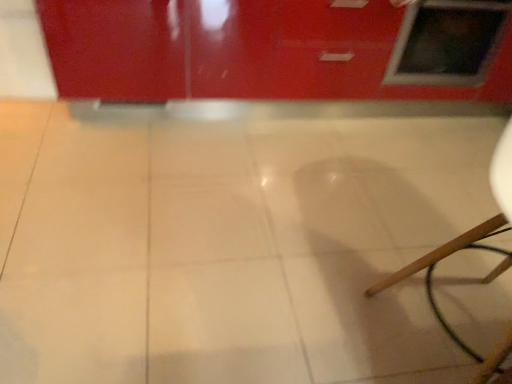
Find the location of a particular element. The image size is (512, 384). white glossy tile at center is located at coordinates (229, 245).

In order to face white glossy tile at center, should I rotate leftwards or rightwards?

Answer: You should look right and rotate roughly 6.554 degrees.

Describe the element at coordinates (229, 245) in the screenshot. I see `white glossy tile at center` at that location.

Image resolution: width=512 pixels, height=384 pixels. What do you see at coordinates (447, 41) in the screenshot?
I see `matte glass window at upper right` at bounding box center [447, 41].

What are the coordinates of `matte glass window at upper right` in the screenshot? It's located at (447, 41).

Where is `white glossy tile at center`? white glossy tile at center is located at coordinates (229, 245).

Which object is positioned more to the right, matte glass window at upper right or white glossy tile at center?

Positioned to the right is matte glass window at upper right.

Which object is closer to the camera taking this photo, matte glass window at upper right or white glossy tile at center?

Positioned in front is white glossy tile at center.

Considering the positions of point (439, 28) and point (186, 231), is point (439, 28) closer or farther from the camera than point (186, 231)?

Point (439, 28).

From the image's perspective, relative to white glossy tile at center, is matte glass window at upper right above or below?

Based on their image positions, matte glass window at upper right is located above white glossy tile at center.

From a real-world perspective, who is located lower, matte glass window at upper right or white glossy tile at center?

white glossy tile at center, from a real-world perspective.

Looking at their sizes, would you say matte glass window at upper right is wider or thinner than white glossy tile at center?

Clearly, matte glass window at upper right has less width compared to white glossy tile at center.

Between matte glass window at upper right and white glossy tile at center, which one has more height?

matte glass window at upper right is taller.

Between matte glass window at upper right and white glossy tile at center, which one has smaller size?

matte glass window at upper right is smaller.

Do you think matte glass window at upper right is within white glossy tile at center, or outside of it?

matte glass window at upper right is spatially situated outside white glossy tile at center.

Are matte glass window at upper right and white glossy tile at center located far from each other?

No, matte glass window at upper right is in close proximity to white glossy tile at center.

Is matte glass window at upper right aimed at white glossy tile at center?

No, matte glass window at upper right does not turn towards white glossy tile at center.

At what (x,y) coordinates should I click in order to perform the action: click on ceramic tile in front of the matte glass window at upper right. Please return your answer as a coordinate pair (x, y). The height and width of the screenshot is (384, 512). Looking at the image, I should click on (229, 245).

Considering the positions of objects white glossy tile at center and matte glass window at upper right in the image provided, who is more to the right, white glossy tile at center or matte glass window at upper right?

From the viewer's perspective, matte glass window at upper right appears more on the right side.

Is white glossy tile at center closer to the viewer compared to matte glass window at upper right?

That is True.

Does point (212, 375) come farther from viewer compared to point (479, 66)?

No.

From the image's perspective, between white glossy tile at center and matte glass window at upper right, which one is located above?

matte glass window at upper right appears higher in the image.

From a real-world perspective, between white glossy tile at center and matte glass window at upper right, who is vertically lower?

white glossy tile at center, from a real-world perspective.

Which of these two, white glossy tile at center or matte glass window at upper right, is thinner?

Thinner between the two is matte glass window at upper right.

Is white glossy tile at center shorter than matte glass window at upper right?

Yes.

Which of these two, white glossy tile at center or matte glass window at upper right, is smaller?

matte glass window at upper right.

Is matte glass window at upper right completely or partially inside white glossy tile at center?

That's incorrect, matte glass window at upper right is not inside white glossy tile at center.

Would you say white glossy tile at center is a long distance from matte glass window at upper right?

That's not correct — white glossy tile at center is a little close to matte glass window at upper right.

Is white glossy tile at center oriented away from matte glass window at upper right?

No, matte glass window at upper right is not at the back of white glossy tile at center.

What's the angular difference between white glossy tile at center and matte glass window at upper right's facing directions?

There is a 0.933-degree angle between the facing directions of white glossy tile at center and matte glass window at upper right.

This screenshot has width=512, height=384. Find the location of `window that is above the white glossy tile at center (from the image's perspective)`. window that is above the white glossy tile at center (from the image's perspective) is located at coordinates [447, 41].

Image resolution: width=512 pixels, height=384 pixels. I want to click on ceramic tile below the matte glass window at upper right (from the image's perspective), so click(229, 245).

The image size is (512, 384). Find the location of `window located on the right of white glossy tile at center`. window located on the right of white glossy tile at center is located at coordinates (447, 41).